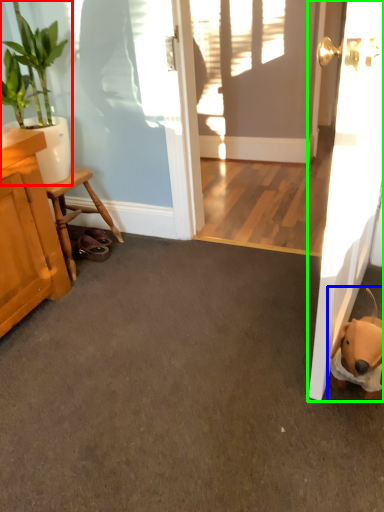
Question: Which is farther away from houseplant (highlighted by a red box)? animal (highlighted by a blue box) or door (highlighted by a green box)?

Choices:
 (A) animal
 (B) door

Answer: (A)